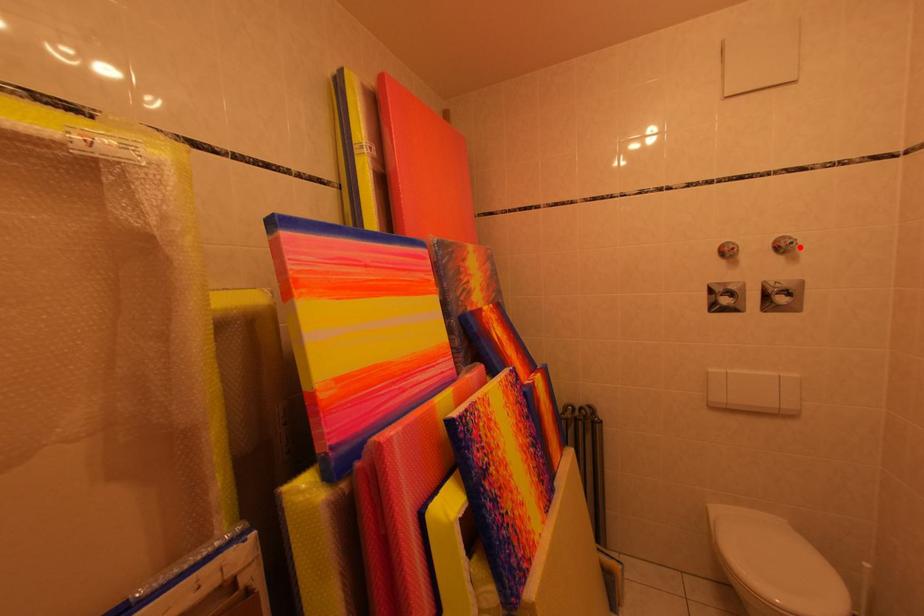
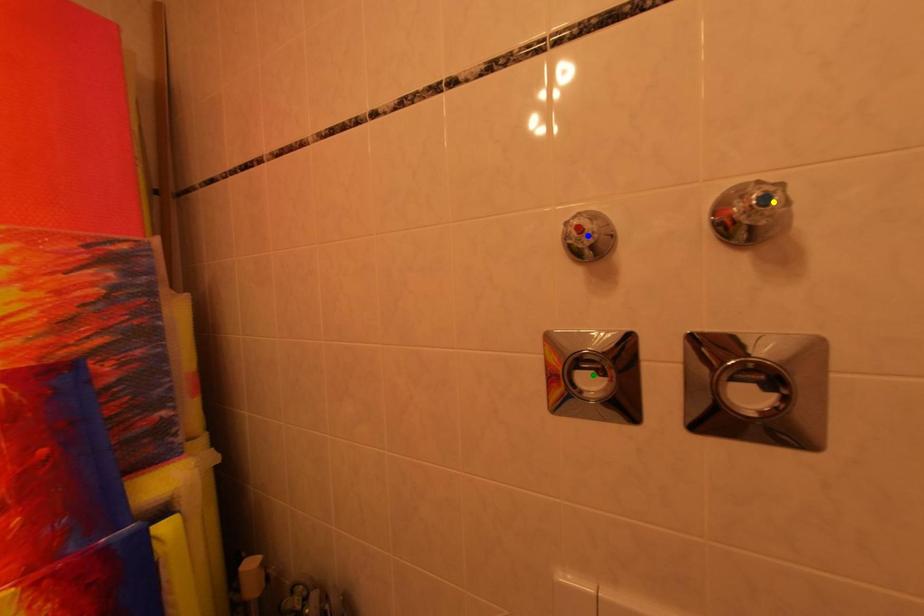
Question: I am providing you with two images of the same scene from different viewpoints. A red point is marked on the first image. You are given multiple points on the second image. Can you choose the point in image 2 that corresponds to the point in image 1?

Choices:
 (A) green point
 (B) blue point
 (C) yellow point

Answer: (C)